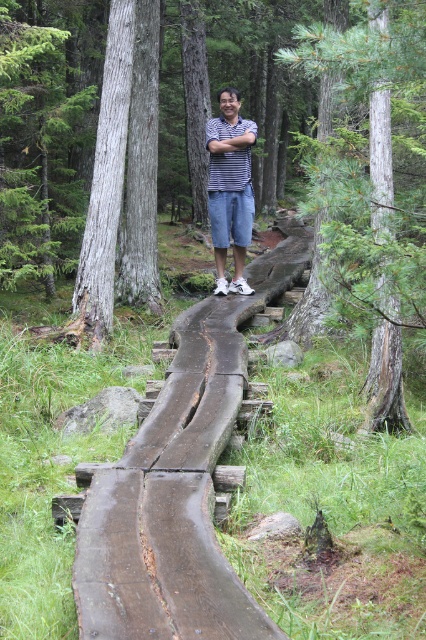
Does point (176, 524) come farther from viewer compared to point (423, 44)?

Yes, point (176, 524) is farther from viewer.

Is brown rough wood at center smaller than green textured tree trunk at center?

No, brown rough wood at center is not smaller than green textured tree trunk at center.

Is point (135, 573) positioned before point (333, 74)?

Yes, it is.

Where is `brown rough wood at center`? brown rough wood at center is located at coordinates (178, 483).

Is striped fabric shirt at center taller than striped cotton shirt at center?

Indeed, striped fabric shirt at center has a greater height compared to striped cotton shirt at center.

Which of these two, striped fabric shirt at center or striped cotton shirt at center, stands taller?

With more height is striped fabric shirt at center.

Which is behind, point (238, 237) or point (215, 128)?

Positioned behind is point (238, 237).

You are a GUI agent. You are given a task and a screenshot of the screen. Output one action in this format:
    pyautogui.click(x=<x>, y=<y>)
    Task: Click on the striped fabric shirt at center
    
    Given the screenshot: What is the action you would take?
    pos(230,188)

Who is higher up, brown rough wood at center or striped cotton shirt at center?

striped cotton shirt at center is higher up.

Who is more forward, (178,456) or (215,125)?

Point (178,456)

Is point (89, 628) positioned behind point (227, 131)?

No, (89, 628) is closer to viewer.

Locate an element on the screen. The image size is (426, 640). brown rough wood at center is located at coordinates (178, 483).